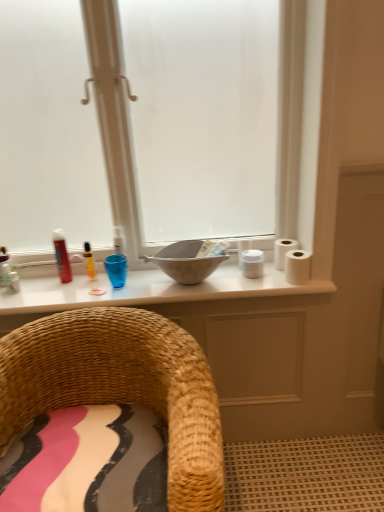
Question: From the image's perspective, is matte red can at left, acting as the 2th toiletry starting from the right, above or below white matte toilet paper at right, the 2th toilet paper viewed from the front?

Choices:
 (A) below
 (B) above

Answer: (B)

Question: Which is correct: matte red can at left, acting as the 2th toiletry starting from the right, is inside white matte toilet paper at right, the first toilet paper viewed from the back, or outside of it?

Choices:
 (A) inside
 (B) outside

Answer: (B)

Question: Based on their relative distances, which object is farther from the matte gray bowl at center?

Choices:
 (A) matte glass window at center
 (B) matte white countertop at center
 (C) white matte toilet paper at right, arranged as the 2th toilet paper when viewed from the back
 (D) woven straw chair at lower left
 (E) white matte toilet paper at right, the first toilet paper viewed from the back

Answer: (A)

Question: Estimate the real-world distances between objects in this image. Which object is closer to the matte gray bowl at center?

Choices:
 (A) matte glass window at center
 (B) matte white countertop at center
 (C) yellow plastic marker at upper center, which is counted as the second toiletry, starting from the left
 (D) woven straw chair at lower left
 (E) white matte toilet paper at right, the first toilet paper viewed from the back

Answer: (B)